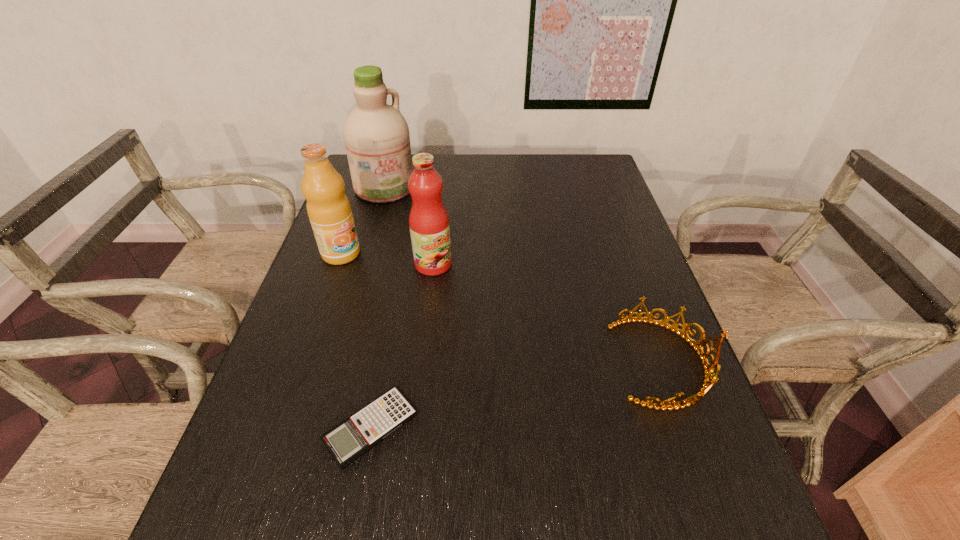
At what (x,y) coordinates should I click in order to perform the action: click on free space on the desktop that is between the shortest object and the second shortest object and is positioned on the front label of the left fruit juice. Please return your answer as a coordinate pair (x, y). The height and width of the screenshot is (540, 960). Looking at the image, I should click on (517, 395).

The width and height of the screenshot is (960, 540). Identify the location of vacant space on the desktop that is between the calculator and the tiara and is positioned on the front label of the right fruit juice. (524, 393).

What are the coordinates of `free space on the desktop that is between the shortest object and the tiara and is positioned on the front label of the cleansing agent` in the screenshot? It's located at (559, 386).